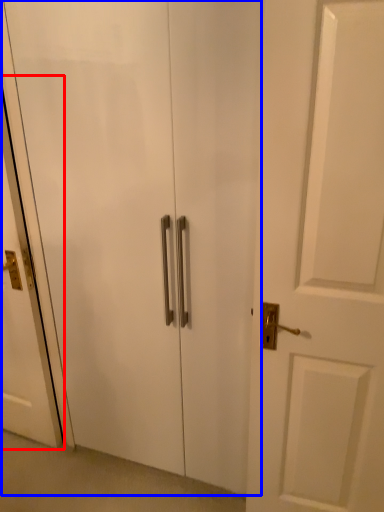
Question: Which object is further to the camera taking this photo, screen door (highlighted by a red box) or elevator (highlighted by a blue box)?

Choices:
 (A) screen door
 (B) elevator

Answer: (A)